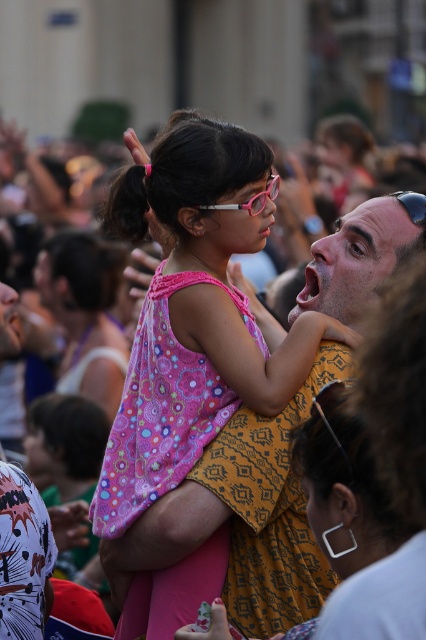
Question: Which point is farther from the camera taking this photo?

Choices:
 (A) (342, 339)
 (B) (394, 195)

Answer: (B)

Question: Does pink fabric dress at center have a lesser width compared to pink plastic glasses at center?

Choices:
 (A) no
 (B) yes

Answer: (A)

Question: Does pink fabric dress at center lie behind pink plastic glasses at upper center?

Choices:
 (A) yes
 (B) no

Answer: (B)

Question: Which of these objects is positioned farthest from the pink fabric dress at center?

Choices:
 (A) pink plastic glasses at upper center
 (B) pink plastic glasses at center

Answer: (A)

Question: Which object appears farthest from the camera in this image?

Choices:
 (A) pink plastic glasses at center
 (B) pink plastic glasses at upper center

Answer: (B)

Question: Is pink fabric dress at center positioned in front of pink plastic glasses at center?

Choices:
 (A) no
 (B) yes

Answer: (B)